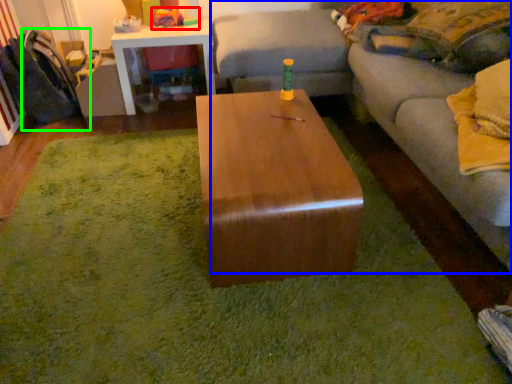
Question: Which is farther away from toy (highlighted by a red box)? studio couch (highlighted by a blue box) or swivel chair (highlighted by a green box)?

Choices:
 (A) studio couch
 (B) swivel chair

Answer: (A)